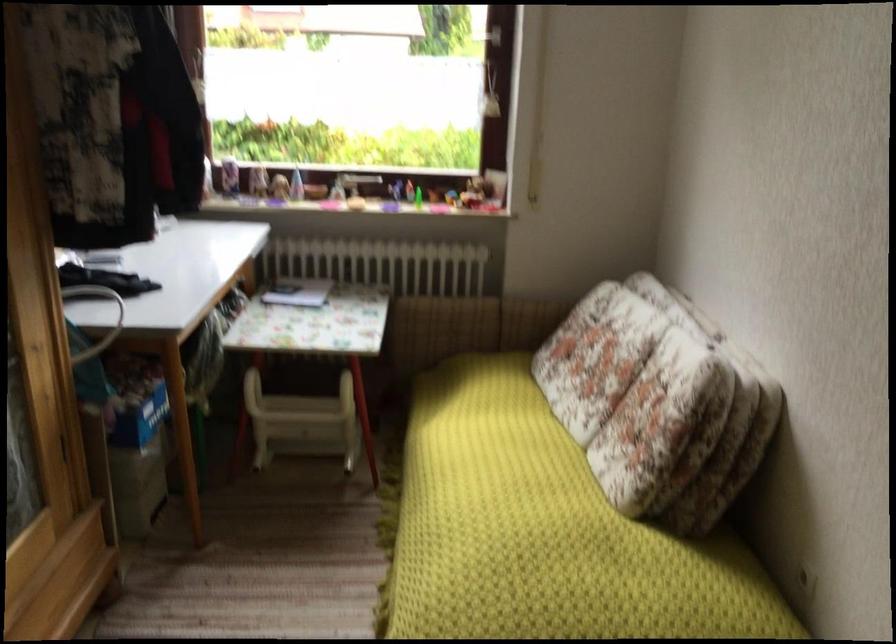
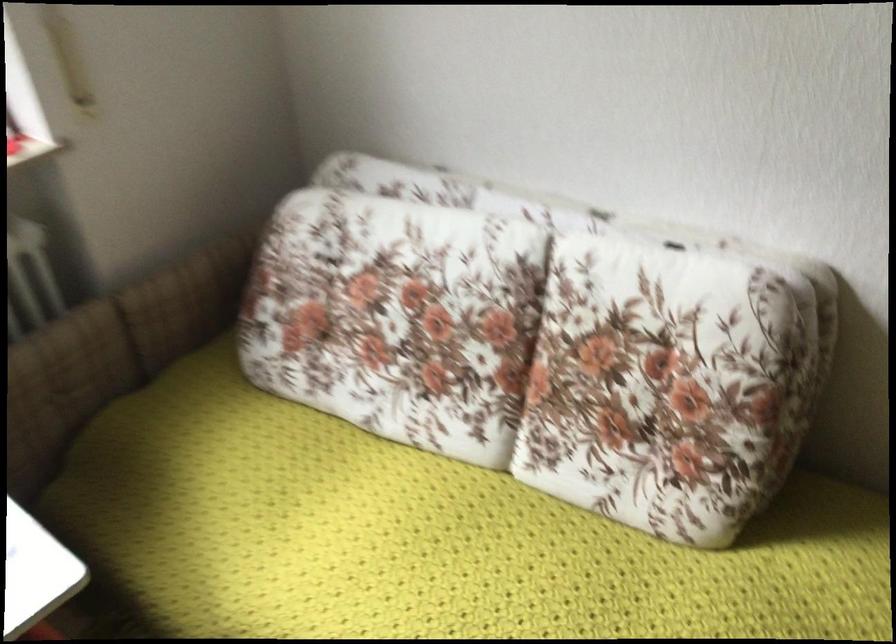
In the second image, find the point that corresponds to (x=658, y=395) in the first image.

(650, 359)